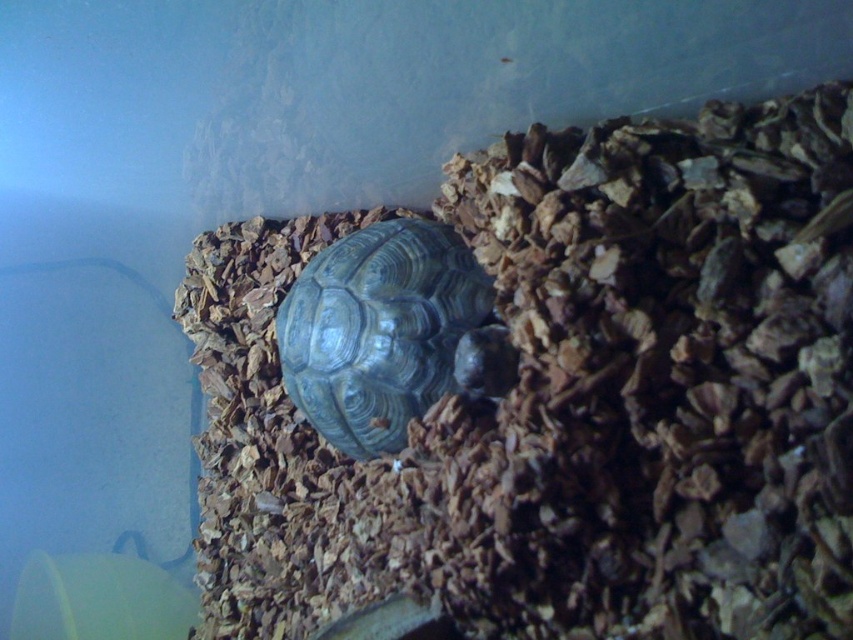
Question: From the image, what is the correct spatial relationship of brown wood chips at center in relation to shiny dark gray tortoise at center?

Choices:
 (A) right
 (B) left

Answer: (B)

Question: Which point is farther to the camera?

Choices:
 (A) brown wood chips at center
 (B) shiny dark gray tortoise at center

Answer: (B)

Question: Is brown wood chips at center bigger than shiny dark gray tortoise at center?

Choices:
 (A) yes
 (B) no

Answer: (A)

Question: Can you confirm if brown wood chips at center is positioned to the left of shiny dark gray tortoise at center?

Choices:
 (A) no
 (B) yes

Answer: (B)